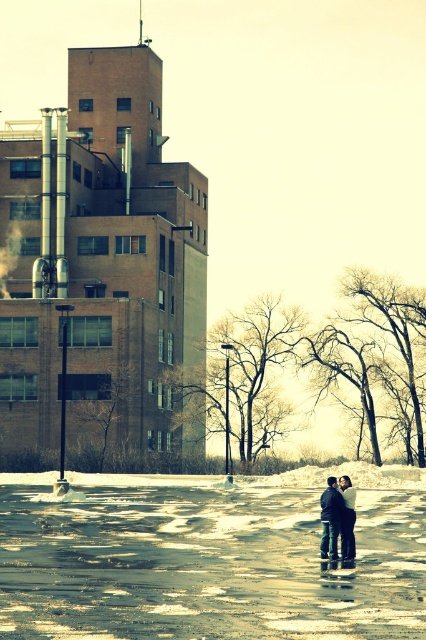
Question: Which point is closer to the camera taking this photo?

Choices:
 (A) (350, 545)
 (B) (411, 540)

Answer: (A)

Question: Can you confirm if white frosty snow at lower center is positioned to the right of dark blue jeans at center?

Choices:
 (A) yes
 (B) no

Answer: (B)

Question: Is white frosty snow at lower center to the left of dark blue jeans at center from the viewer's perspective?

Choices:
 (A) yes
 (B) no

Answer: (A)

Question: Which of the following is the closest to the observer?

Choices:
 (A) dark blue jeans at center
 (B) white frosty snow at lower center

Answer: (B)

Question: From the image, what is the correct spatial relationship of white frosty snow at lower center in relation to dark blue jeans at center?

Choices:
 (A) left
 (B) right

Answer: (A)